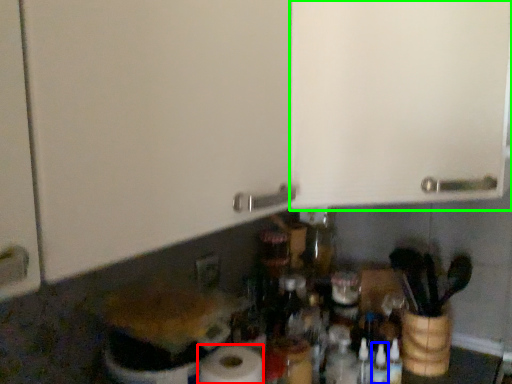
Question: Considering the real-world distances, which object is farthest from paper towel (highlighted by a red box)? bottle (highlighted by a blue box) or cabinetry (highlighted by a green box)?

Choices:
 (A) bottle
 (B) cabinetry

Answer: (B)